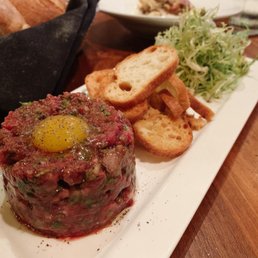
Image resolution: width=258 pixels, height=258 pixels. I want to click on shadow of rear white porcelain plate, so click(113, 34).